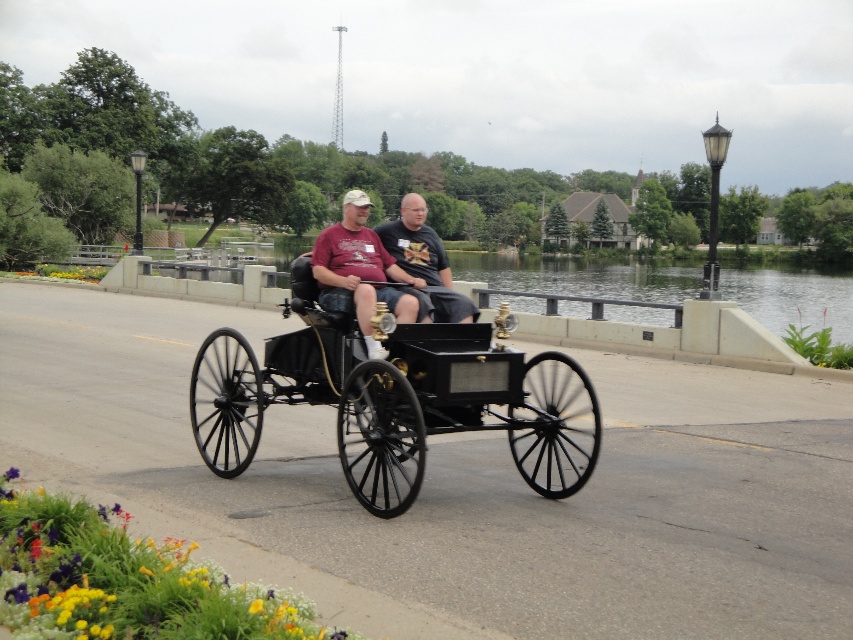
Describe the element at coordinates (395, 400) in the screenshot. I see `black polished wood horse cart at center` at that location.

This screenshot has width=853, height=640. I want to click on black polished wood horse cart at center, so click(395, 400).

Does point (352, 189) lie in front of point (434, 282)?

No, it is not.

Can you confirm if matte black buggy at center is shorter than dark gray fabric shirt at center?

Yes, matte black buggy at center is shorter than dark gray fabric shirt at center.

Where is `matte black buggy at center`? matte black buggy at center is located at coordinates (360, 269).

Find the location of a particular element. matte black buggy at center is located at coordinates (360, 269).

Can you confirm if black polished wood horse cart at center is bigger than matte black buggy at center?

Yes, black polished wood horse cart at center is bigger than matte black buggy at center.

Is black polished wood horse cart at center behind matte black buggy at center?

That is False.

Who is more forward, (492, 380) or (357, 301)?

Positioned in front is point (492, 380).

At what (x,y) coordinates should I click in order to perform the action: click on black polished wood horse cart at center. Please return your answer as a coordinate pair (x, y). This screenshot has height=640, width=853. Looking at the image, I should click on (395, 400).